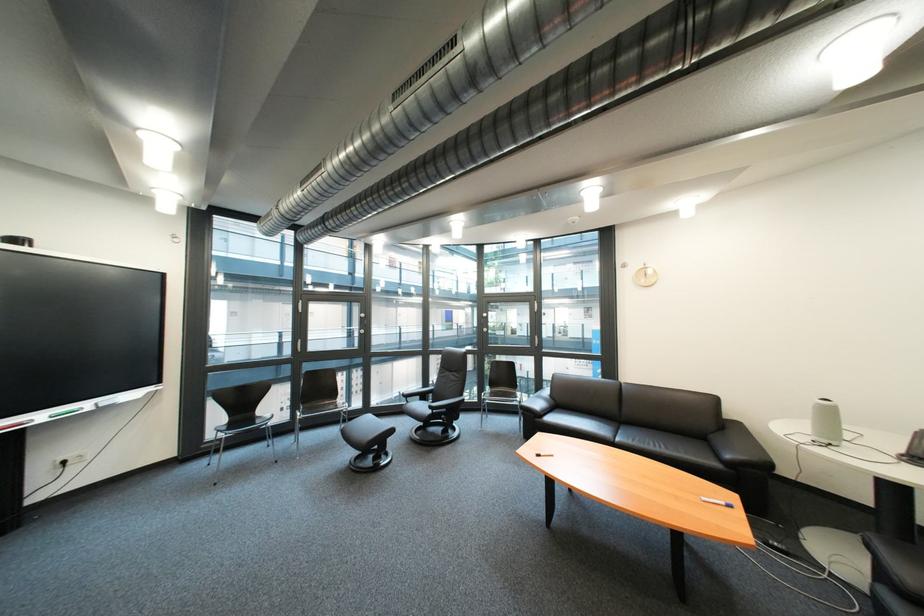
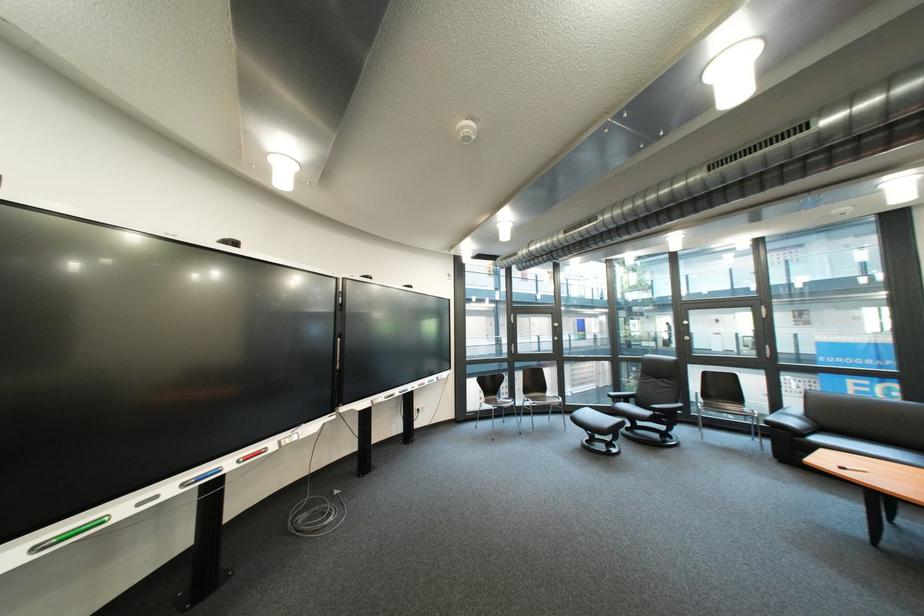
Find the pixel in the second image that matches pixel 555 456 in the first image.

(862, 469)